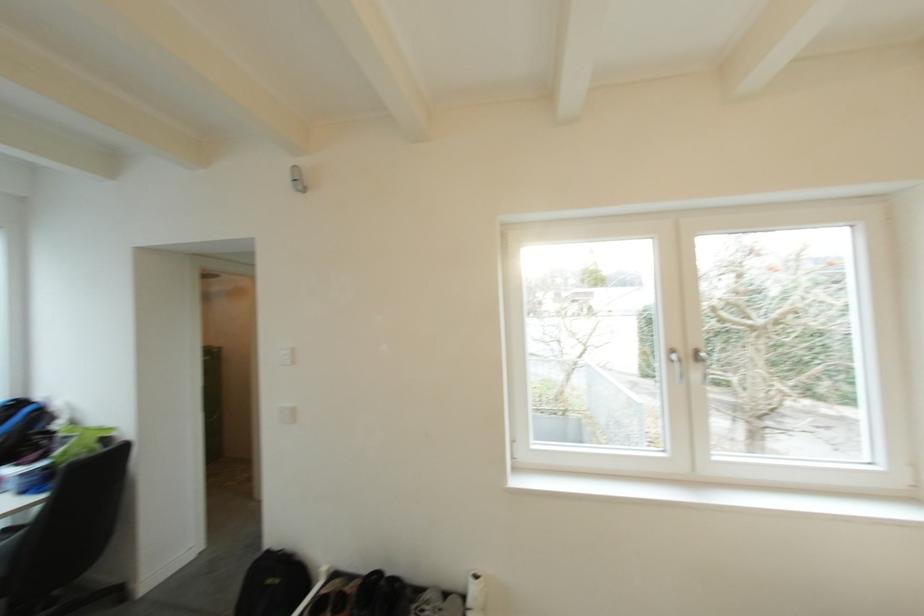
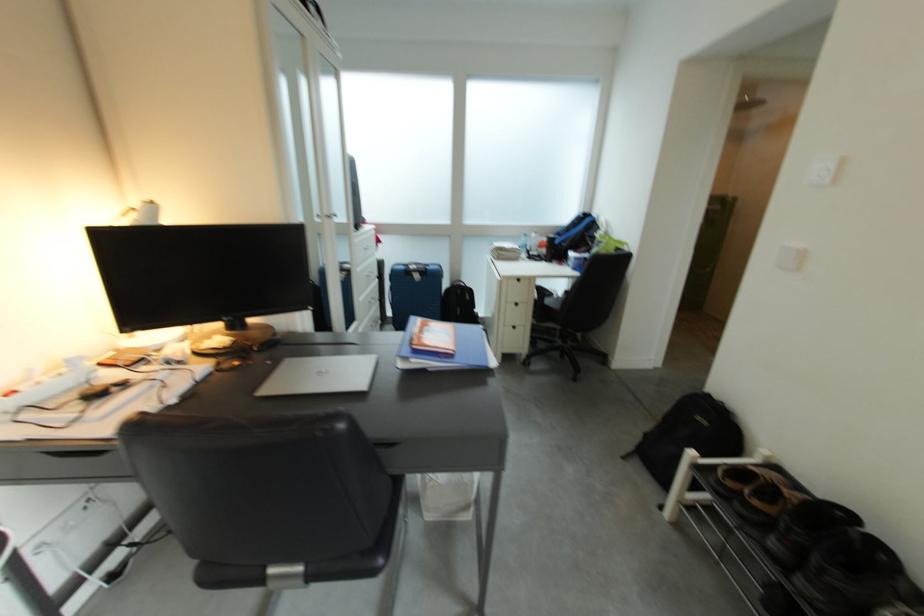
Based on the continuous images, in which direction is the camera rotating?

The camera rotated toward left-down.